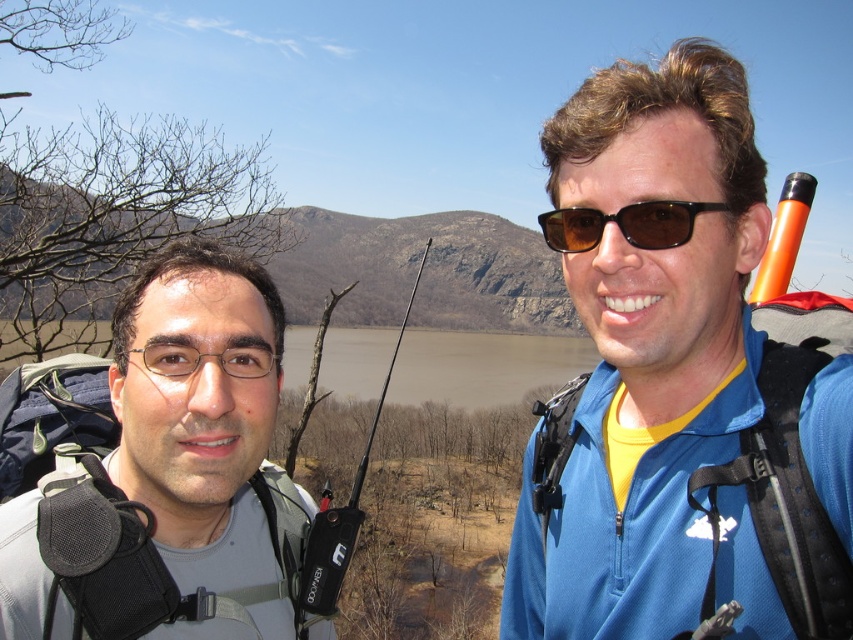
Question: Is the position of blue fabric jacket at center more distant than that of gray fabric backpack at left?

Choices:
 (A) yes
 (B) no

Answer: (B)

Question: Which object is positioned closest to the gray fabric backpack at left?

Choices:
 (A) brown matte sunglasses at upper right
 (B) blue fabric jacket at center

Answer: (B)

Question: Which of the following is the farthest from the observer?

Choices:
 (A) gray fabric backpack at left
 (B) brown matte sunglasses at upper right

Answer: (B)

Question: Does gray fabric backpack at left come in front of brown matte sunglasses at upper right?

Choices:
 (A) yes
 (B) no

Answer: (A)

Question: Does blue fabric jacket at center appear over gray fabric backpack at left?

Choices:
 (A) no
 (B) yes

Answer: (B)

Question: Which object appears farthest from the camera in this image?

Choices:
 (A) brown matte sunglasses at upper right
 (B) gray fabric backpack at left
 (C) blue fabric jacket at center

Answer: (A)